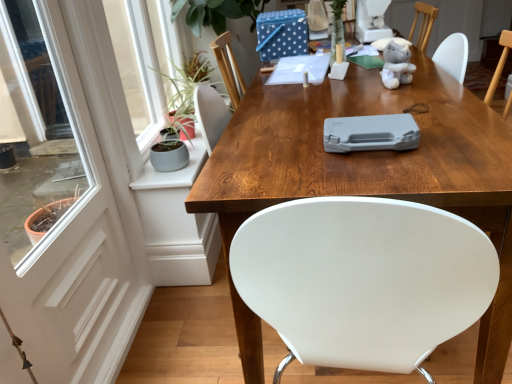
At what (x,y) coordinates should I click in order to perform the action: click on vacant space to the right of soft gray plush bear at upper right. Please return your answer as a coordinate pair (x, y). This screenshot has height=384, width=512. Looking at the image, I should click on (428, 74).